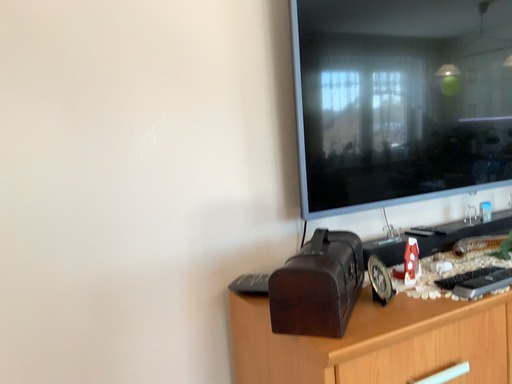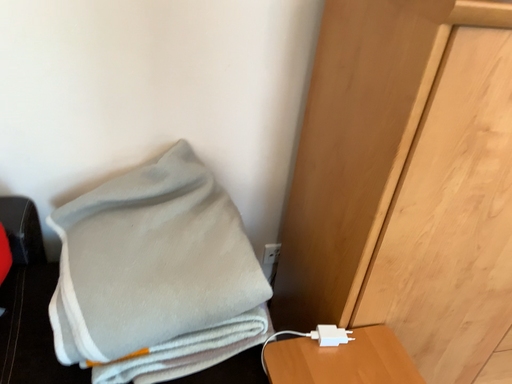
Question: How did the camera likely rotate when shooting the video?

Choices:
 (A) rotated left
 (B) rotated right

Answer: (A)